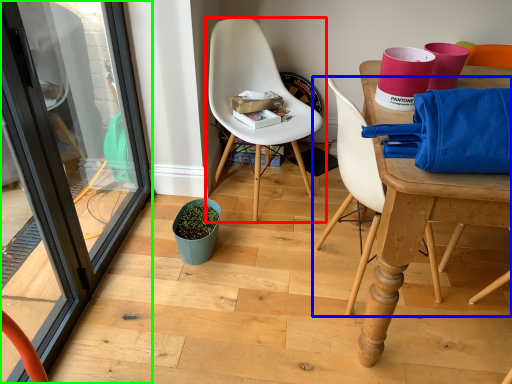
Question: Which object is the closest to the chair (highlighted by a red box)? Choose among these: chair (highlighted by a blue box) or screen door (highlighted by a green box).

Choices:
 (A) chair
 (B) screen door

Answer: (A)